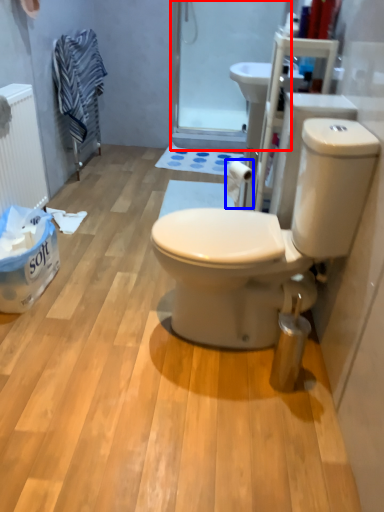
Question: Which point is closer to the camera, screen door (highlighted by a red box) or toilet paper (highlighted by a blue box)?

Choices:
 (A) screen door
 (B) toilet paper

Answer: (B)